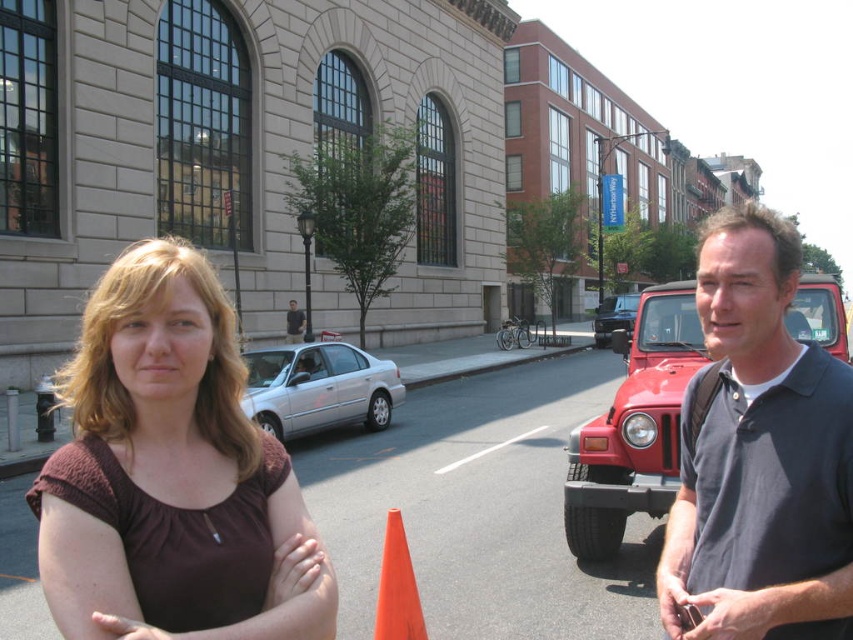
Question: Which point is closer to the camera?

Choices:
 (A) metallic red car at center
 (B) dark gray shirt at center
 (C) satin silver sedan at center

Answer: (A)

Question: Among these objects, which one is nearest to the camera?

Choices:
 (A) metallic red car at center
 (B) dark gray polo shirt at right
 (C) brown fabric shirt at center

Answer: (C)

Question: Can you confirm if brown fabric shirt at center is positioned below metallic red car at center?

Choices:
 (A) yes
 (B) no

Answer: (A)

Question: Is metallic red car at center to the right of dark gray shirt at center from the viewer's perspective?

Choices:
 (A) no
 (B) yes

Answer: (B)

Question: Does orange matte traffic cone at center have a larger size compared to dark gray shirt at center?

Choices:
 (A) yes
 (B) no

Answer: (B)

Question: Which point is farther to the camera?

Choices:
 (A) (224, 298)
 (B) (784, 516)

Answer: (B)